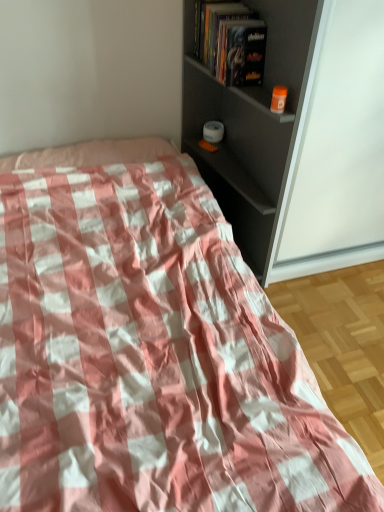
Question: In the image, is hardcover book at upper center positioned in front of or behind matte gray shelf at upper right?

Choices:
 (A) behind
 (B) front

Answer: (A)

Question: Considering the relative positions of hardcover book at upper center and matte gray shelf at upper right in the image provided, is hardcover book at upper center to the left or to the right of matte gray shelf at upper right?

Choices:
 (A) left
 (B) right

Answer: (B)

Question: Estimate the real-world distances between objects in this image. Which object is farther from the matte gray shelf at upper right?

Choices:
 (A) pink checkered fabric at center
 (B) hardcover book at upper center

Answer: (A)

Question: Estimate the real-world distances between objects in this image. Which object is farther from the pink checkered fabric at center?

Choices:
 (A) hardcover book at upper center
 (B) matte gray shelf at upper right

Answer: (A)